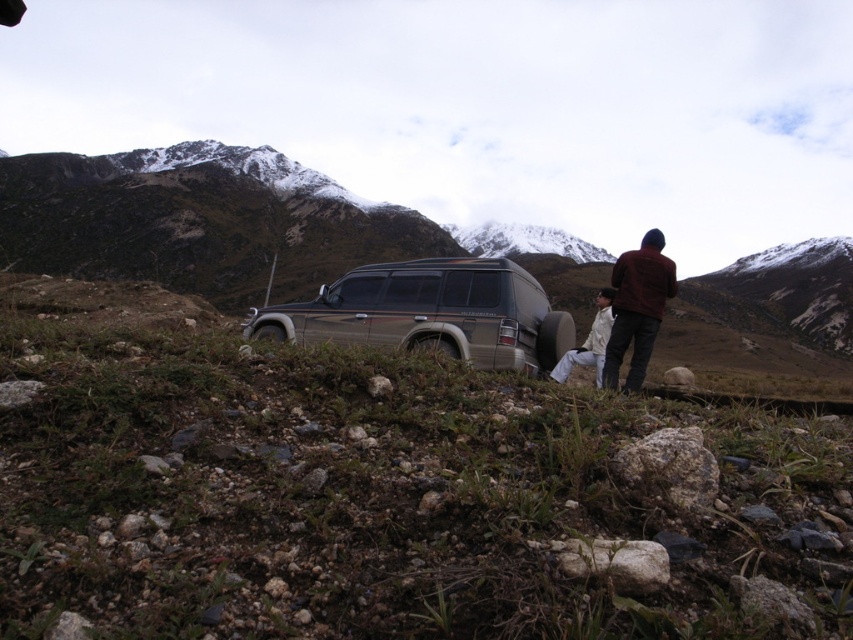
You are an outdoor enthusiast planning to take a photo of the dark red sweater at right and the snowy granite mountain at upper center. Which object should you focus on first if you want to capture both in a single frame without moving the camera?

You should focus on the snowy granite mountain at upper center first because it occupies more space in the frame than the dark red sweater at right, ensuring it stays in focus while adjusting the depth of field to include the smaller sweater.

From the picture: You are a hiker preparing to cross the rocky terrain in the image. You have a dark red sweater at right and white matte pants at center. Which clothing item is closer to the spare tire mounted on the back of the silver SUV?

The dark red sweater at right is positioned on the right side of white matte pants at center. Since the SUV is angled slightly towards the left, the spare tire is on its back, which would be the rear part facing the right side. Therefore, the dark red sweater at right is closer to the spare tire mounted on the back of the silver SUV.

You are an outdoor enthusiast who has just arrived at this rugged outdoor scene. You notice a dark red sweater at right. Where exactly is it located in the scene?

The dark red sweater at right is located at point (637, 307) in the scene.